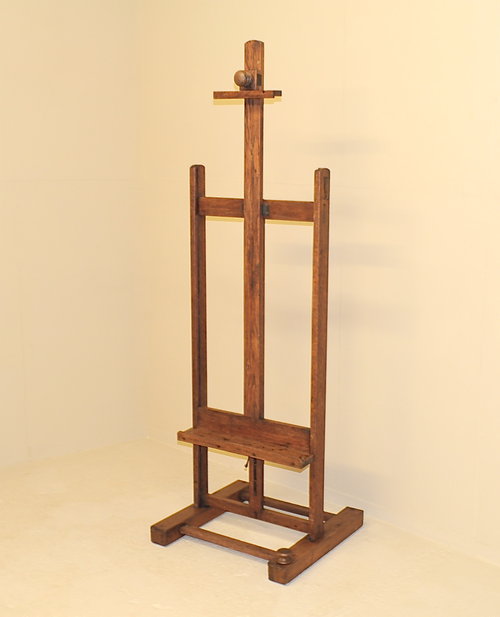
Where is `knob`? The width and height of the screenshot is (500, 617). knob is located at coordinates (245, 77), (284, 555).